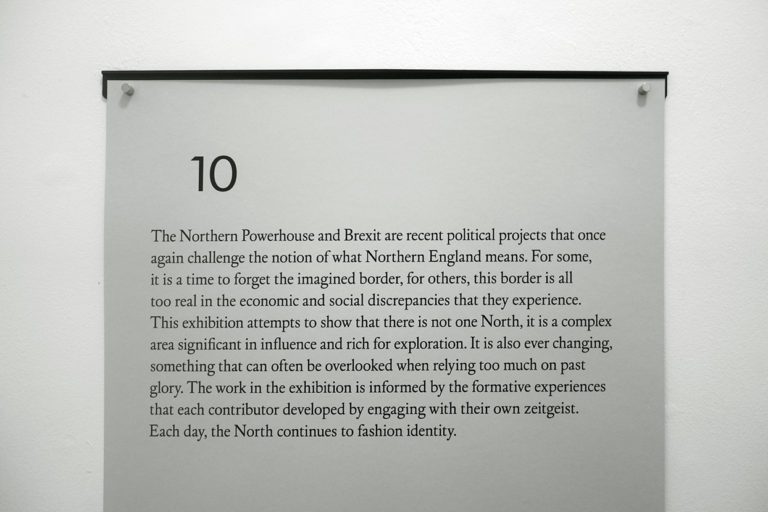
Locate an element on the screen. This screenshot has height=512, width=768. black shelf or thing on the wall is located at coordinates (389, 73).